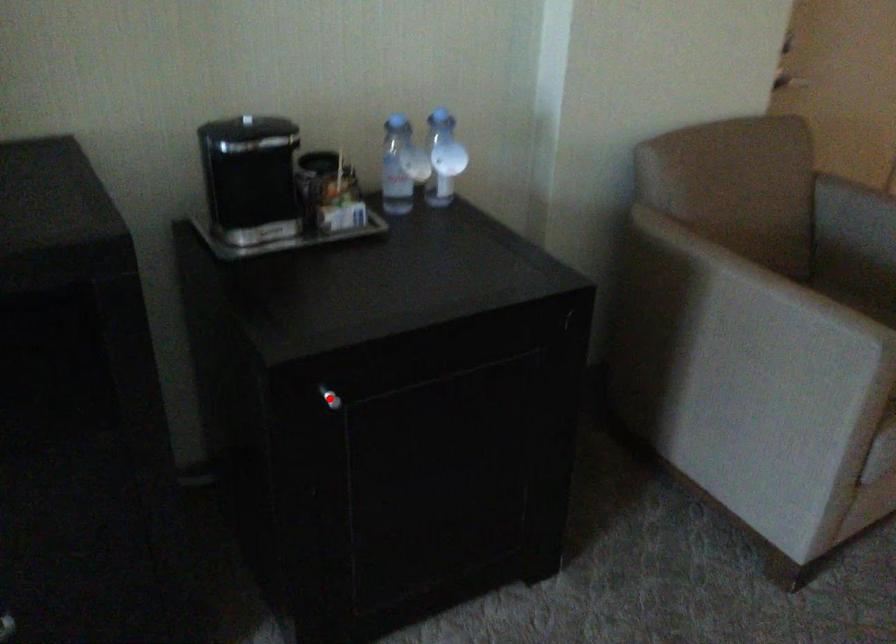
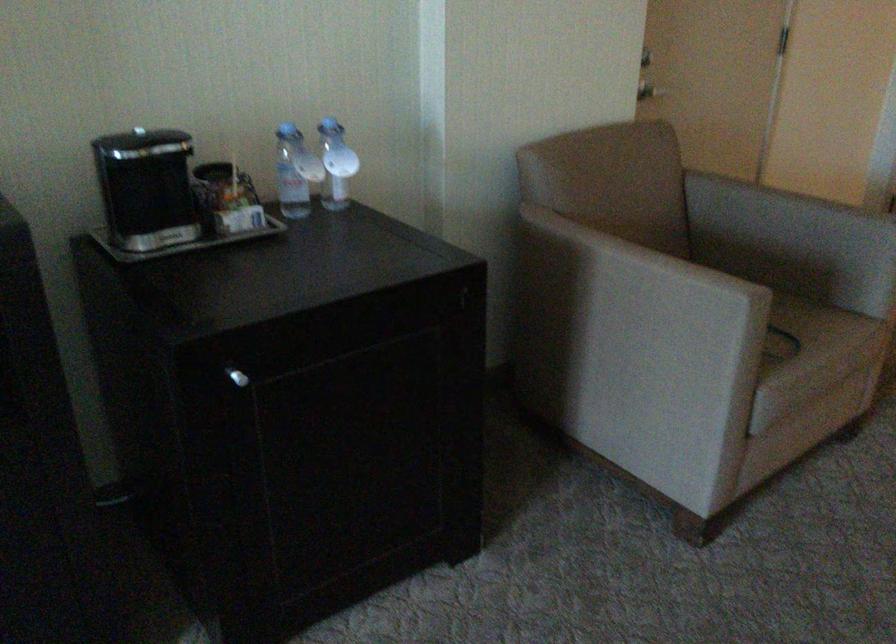
Locate, in the second image, the point that corresponds to the highlighted location in the first image.

(237, 377)